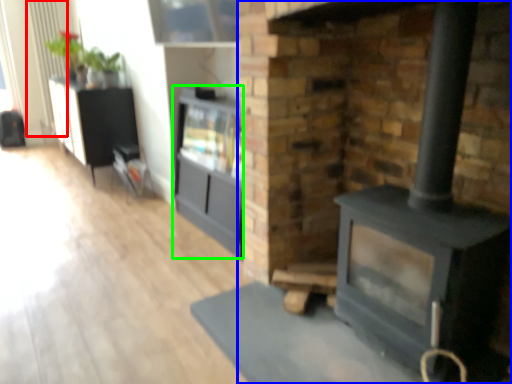
Question: Considering the real-world distances, which object is farthest from radiator (highlighted by a red box)? fireplace (highlighted by a blue box) or entertainment center (highlighted by a green box)?

Choices:
 (A) fireplace
 (B) entertainment center

Answer: (A)